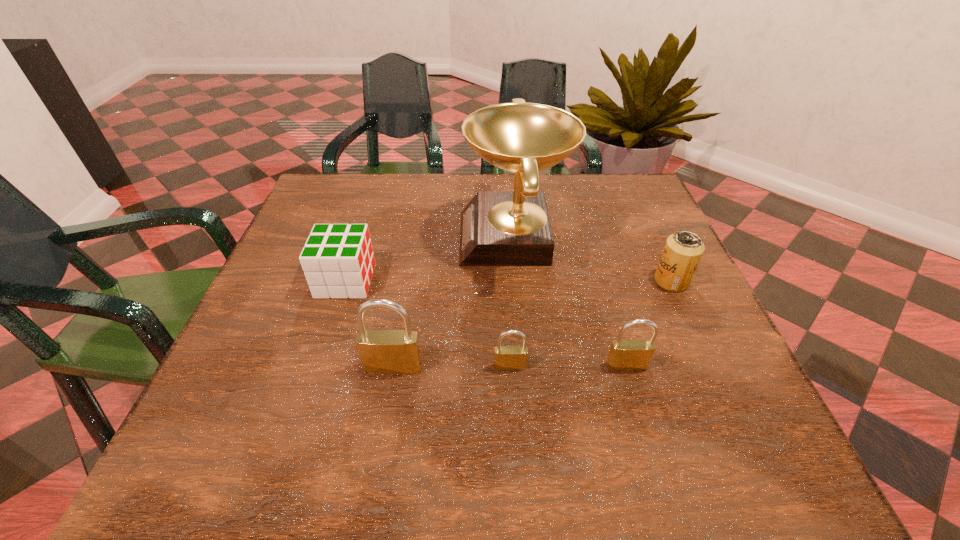
Where is `free area in between the shortest padlock and the second object from right to left`? Image resolution: width=960 pixels, height=540 pixels. free area in between the shortest padlock and the second object from right to left is located at coordinates (568, 366).

Identify the location of free space between the award and the rightmost object. (592, 260).

This screenshot has width=960, height=540. In order to click on vacant space that is in between the tallest padlock and the shortest padlock in this screenshot , I will do `click(452, 367)`.

Image resolution: width=960 pixels, height=540 pixels. I want to click on vacant space that's between the tallest object and the beer can, so click(x=592, y=260).

Locate an element on the screen. This screenshot has width=960, height=540. empty space between the award and the shortest padlock is located at coordinates (512, 302).

This screenshot has width=960, height=540. I want to click on free space between the cube and the second padlock from right to left, so click(428, 323).

Identify which object is the fourth nearest to the rightmost object. Please provide its 2D coordinates. Your answer should be formatted as a tuple, i.e. [(x, y)], where the tuple contains the x and y coordinates of a point satisfying the conditions above.

[(388, 352)]

Where is `the fourth closest object to the shortest padlock`? This screenshot has height=540, width=960. the fourth closest object to the shortest padlock is located at coordinates 338,261.

The width and height of the screenshot is (960, 540). I want to click on padlock that stands as the closest to the leftmost object, so click(x=388, y=352).

Point out which padlock is positioned as the third nearest to the leftmost object. Please provide its 2D coordinates. Your answer should be formatted as a tuple, i.e. [(x, y)], where the tuple contains the x and y coordinates of a point satisfying the conditions above.

[(625, 355)]